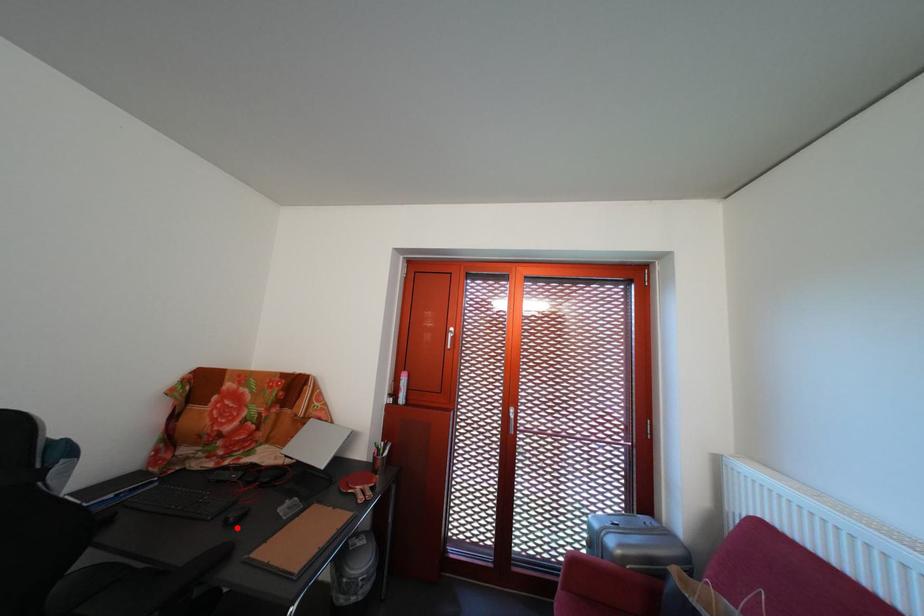
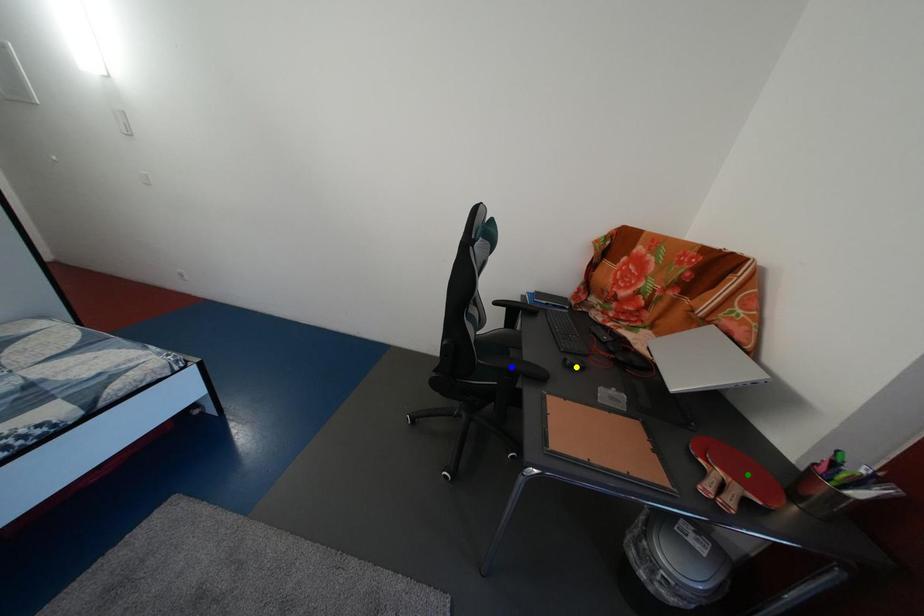
Question: I am providing you with two images of the same scene from different viewpoints. A red point is marked on the first image. You are given multiple points on the second image. Which point in image 2 represents the same 3d spot as the red point in image 1?

Choices:
 (A) yellow point
 (B) green point
 (C) blue point

Answer: (A)